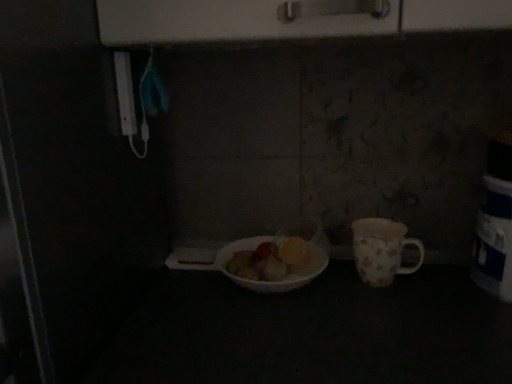
Question: Based on their positions, is floral porcelain mug at right located to the left or right of white glossy bowl at center?

Choices:
 (A) left
 (B) right

Answer: (B)

Question: From the image's perspective, is floral porcelain mug at right located above or below white glossy bowl at center?

Choices:
 (A) above
 (B) below

Answer: (A)

Question: From a real-world perspective, is floral porcelain mug at right above or below white glossy bowl at center?

Choices:
 (A) above
 (B) below

Answer: (A)

Question: Is white glossy bowl at center bigger or smaller than floral porcelain mug at right?

Choices:
 (A) small
 (B) big

Answer: (B)

Question: Looking at their shapes, would you say white glossy bowl at center is wider or thinner than floral porcelain mug at right?

Choices:
 (A) thin
 (B) wide

Answer: (B)

Question: Is white glossy bowl at center situated inside floral porcelain mug at right or outside?

Choices:
 (A) inside
 (B) outside

Answer: (B)

Question: Considering the positions of white glossy bowl at center and floral porcelain mug at right in the image, is white glossy bowl at center taller or shorter than floral porcelain mug at right?

Choices:
 (A) tall
 (B) short

Answer: (B)